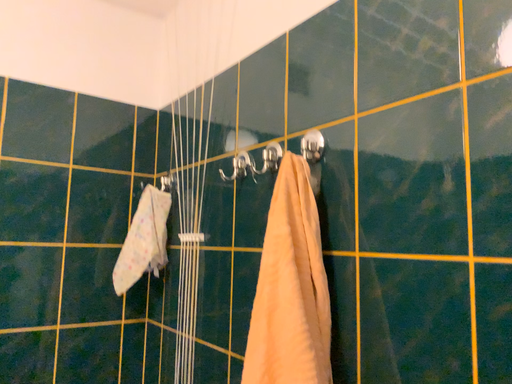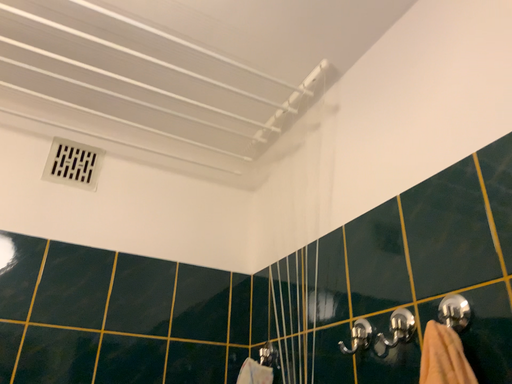
Question: Which way did the camera rotate in the video?

Choices:
 (A) rotated downward
 (B) rotated upward

Answer: (B)